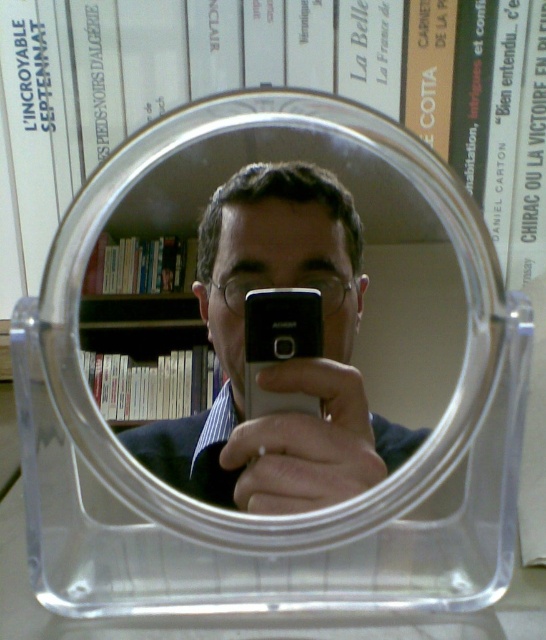
Question: Does clear plastic mirror at center appear on the left side of black plastic phone at center?

Choices:
 (A) yes
 (B) no

Answer: (A)

Question: Which point appears farthest from the camera in this image?

Choices:
 (A) (449, 310)
 (B) (302, 300)

Answer: (A)

Question: Which point is farther from the camera taking this photo?

Choices:
 (A) (283, 157)
 (B) (314, 321)

Answer: (A)

Question: Can you confirm if clear plastic mirror at center is thinner than black plastic phone at center?

Choices:
 (A) no
 (B) yes

Answer: (A)

Question: Does clear plastic mirror at center appear on the left side of black plastic phone at center?

Choices:
 (A) no
 (B) yes

Answer: (B)